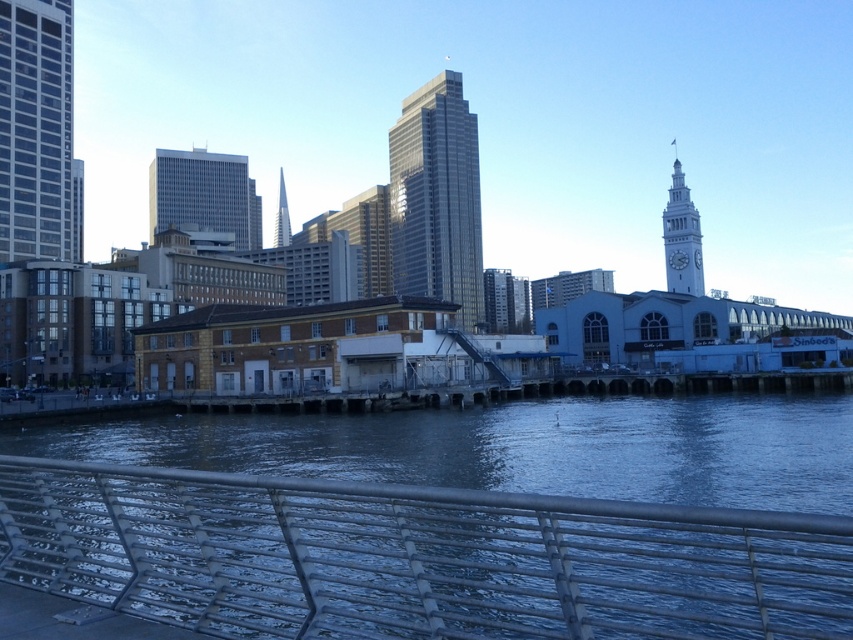
You are standing at the waterfront and want to take a photo of the clock tower. The metallic silver rail at lower center is in your way. Can you move to the left or right to avoid it?

The metallic silver rail at lower center is positioned at coordinates approximately 0.872 on the x and 0.487 on the y axis. Since the clock tower is located towards the center right of the midground, moving to the right of the rail would align you better with the tower while avoiding obstruction. Alternatively, moving left might still allow a clear shot if the rail is narrow enough, but the optimal path is to the right side of the rail.